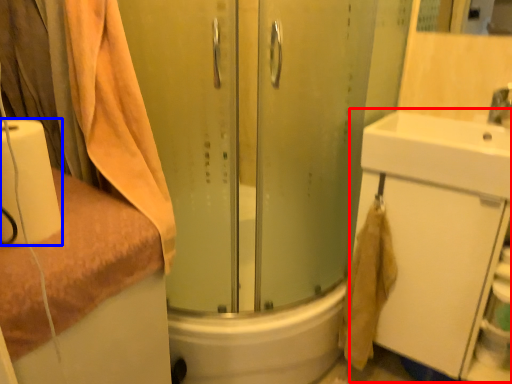
Question: Which of the following is the closest to the observer, bathroom cabinet (highlighted by a red box) or toilet paper (highlighted by a blue box)?

Choices:
 (A) bathroom cabinet
 (B) toilet paper

Answer: (B)